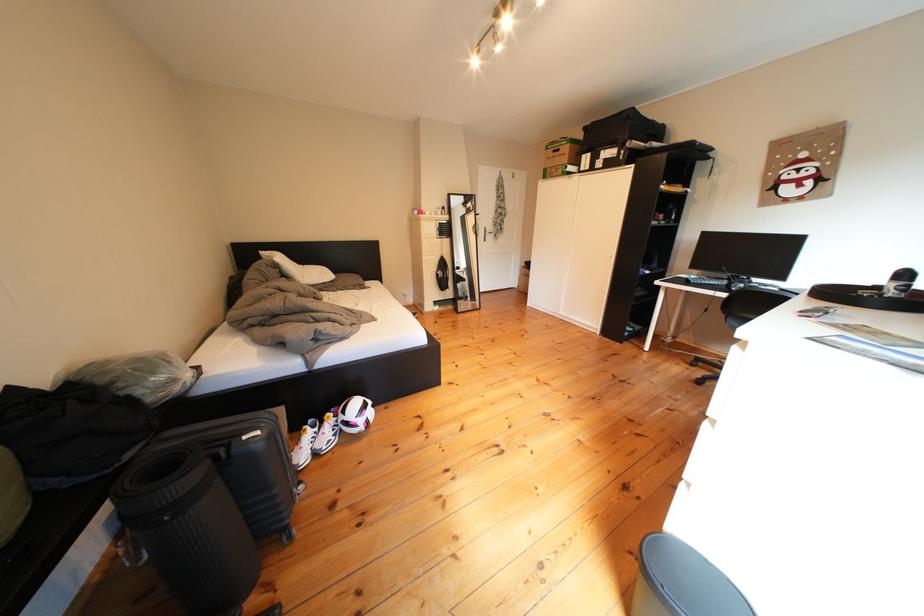
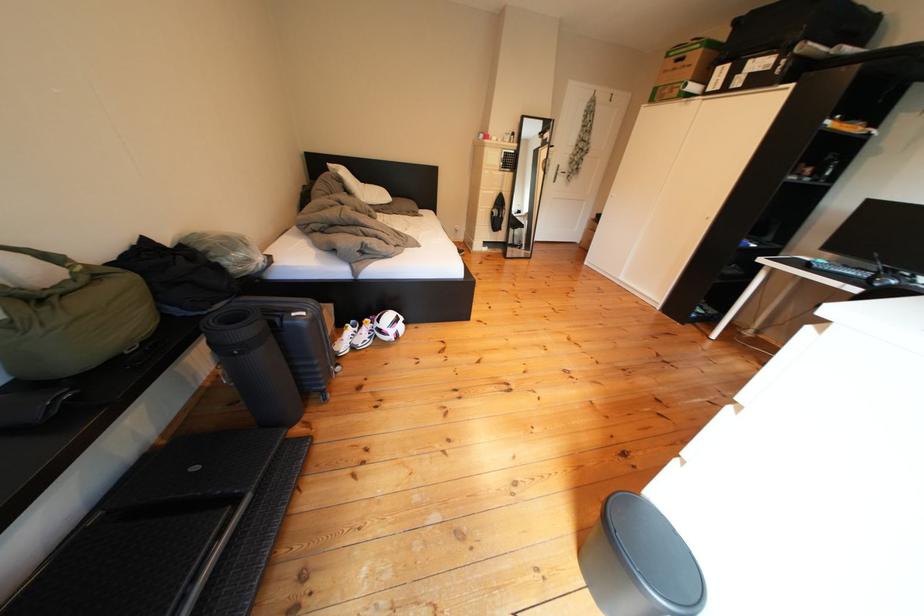
Locate, in the second image, the point that corresponds to [499,238] in the first image.

(570, 179)